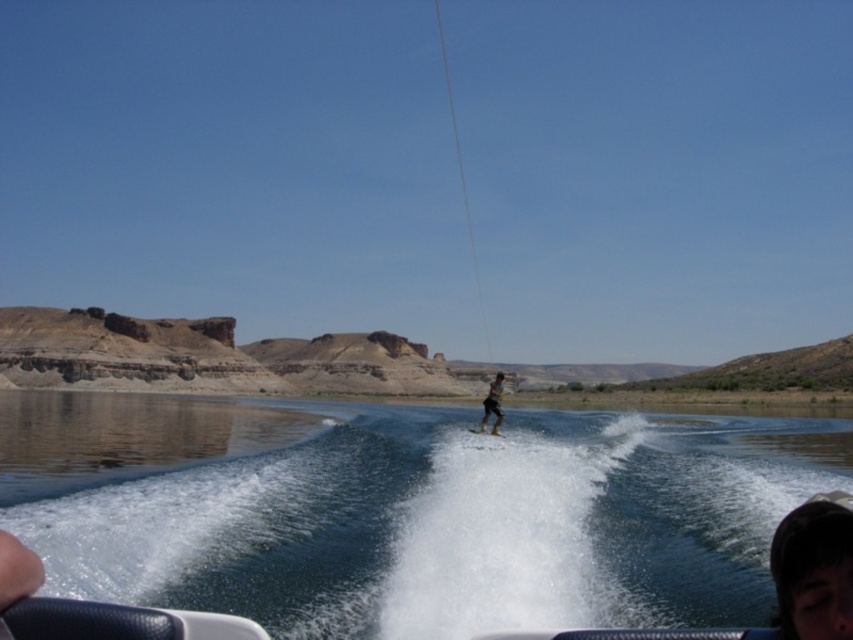
Can you confirm if smooth skin face at lower right is bigger than dark brown leather shorts at center?

No.

Between point (787, 548) and point (497, 380), which one is positioned behind?

The point (497, 380) is more distant.

Where is `smooth skin face at lower right`? This screenshot has width=853, height=640. smooth skin face at lower right is located at coordinates (805, 552).

Consider the image. Who is more forward, (450, 552) or (793, 561)?

Point (793, 561) is more forward.

Does clear blue water at center have a smaller size compared to smooth skin face at lower right?

Incorrect, clear blue water at center is not smaller in size than smooth skin face at lower right.

In order to click on clear blue water at center in this screenshot , I will do `click(407, 509)`.

Image resolution: width=853 pixels, height=640 pixels. What do you see at coordinates (407, 509) in the screenshot?
I see `clear blue water at center` at bounding box center [407, 509].

Can you confirm if clear blue water at center is positioned to the left of white matte water ski at center?

Correct, you'll find clear blue water at center to the left of white matte water ski at center.

Between point (712, 488) and point (495, 433), which one is positioned behind?

The point (495, 433) is more distant.

At what (x,y) coordinates should I click in order to perform the action: click on clear blue water at center. Please return your answer as a coordinate pair (x, y). This screenshot has width=853, height=640. Looking at the image, I should click on (407, 509).